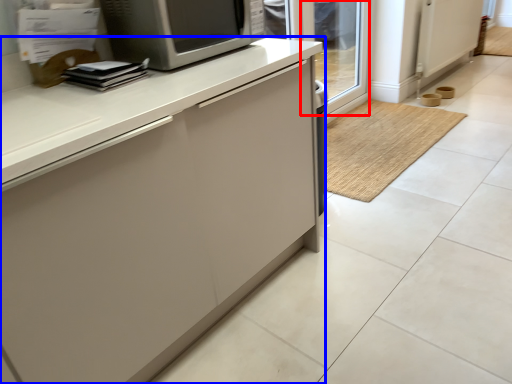
Question: Which object appears closest to the camera in this image, glass door (highlighted by a red box) or cabinetry (highlighted by a blue box)?

Choices:
 (A) glass door
 (B) cabinetry

Answer: (B)